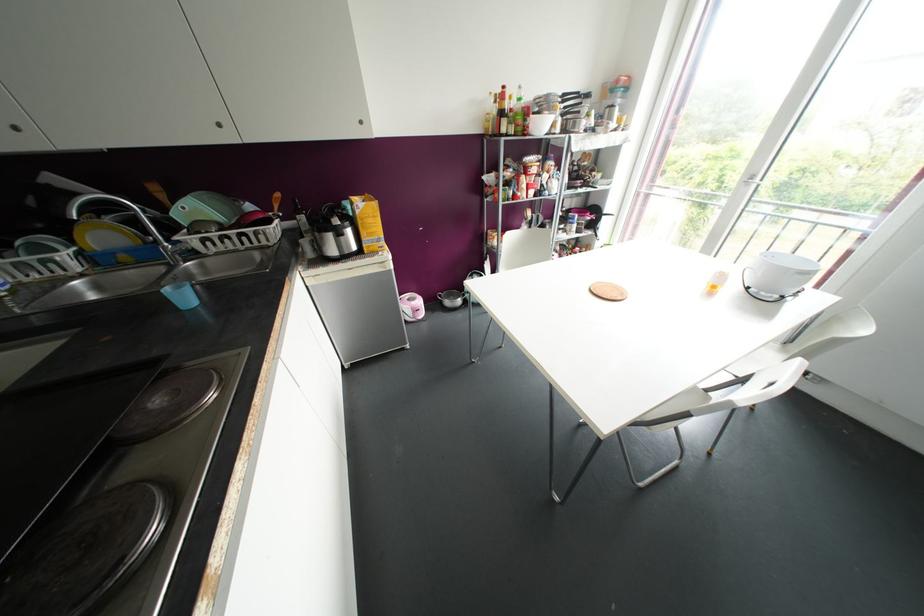
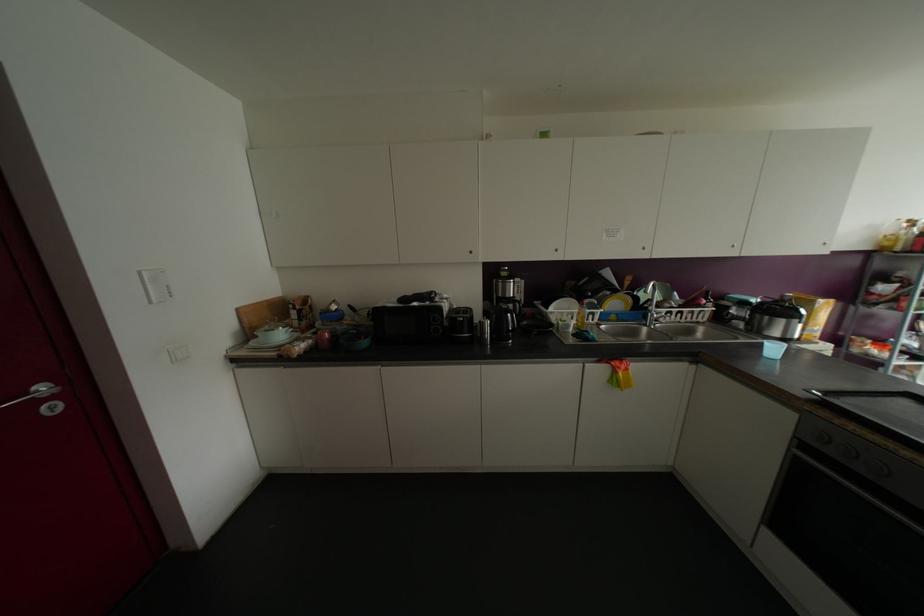
Locate, in the second image, the point that corresponds to the point at 231,246 in the first image.

(677, 318)